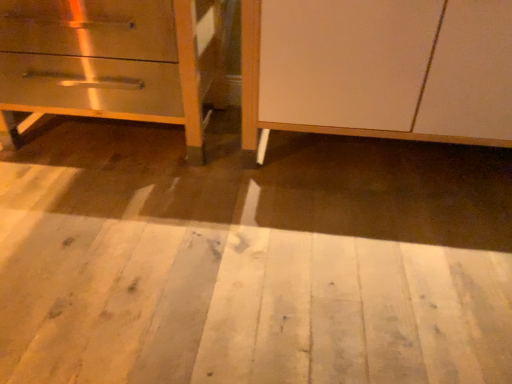
This screenshot has width=512, height=384. Find the location of `white wood floor at lower center`. white wood floor at lower center is located at coordinates (244, 283).

From the picture: What is the approximate width of white matte cabinet at center?

26.75 inches.

Identify the location of metallic silver drawer at left. (114, 62).

Which of these two, metallic silver drawer at left or white wood floor at lower center, is smaller?

Smaller between the two is white wood floor at lower center.

From a real-world perspective, who is located higher, metallic silver drawer at left or white wood floor at lower center?

metallic silver drawer at left.

Can we say metallic silver drawer at left lies outside white wood floor at lower center?

Absolutely, metallic silver drawer at left is external to white wood floor at lower center.

Relative to white wood floor at lower center, is metallic silver drawer at left in front or behind?

Clearly, metallic silver drawer at left is behind white wood floor at lower center.

Is white matte cabinet at center far away from white wood floor at lower center?

They are positioned close to each other.

Between point (364, 26) and point (122, 268), which one is positioned behind?

Positioned behind is point (364, 26).

Is white matte cabinet at center spatially inside white wood floor at lower center, or outside of it?

white matte cabinet at center cannot be found inside white wood floor at lower center.

Locate an element on the screen. furniture behind the white wood floor at lower center is located at coordinates (378, 69).

In the scene shown: From a real-world perspective, relative to white matte cabinet at center, is white wood floor at lower center vertically above or below?

From a real-world perspective, white wood floor at lower center is physically below white matte cabinet at center.

Is point (119, 348) closer or farther from the camera than point (274, 115)?

Point (119, 348).

Considering the sizes of objects white wood floor at lower center and white matte cabinet at center in the image provided, who is taller, white wood floor at lower center or white matte cabinet at center?

white matte cabinet at center.

From their relative heights in the image, would you say white matte cabinet at center is taller or shorter than metallic silver drawer at left?

Clearly, white matte cabinet at center is taller compared to metallic silver drawer at left.

From the picture: Is there a large distance between white matte cabinet at center and metallic silver drawer at left?

white matte cabinet at center is near metallic silver drawer at left, not far away.

Between white matte cabinet at center and metallic silver drawer at left, which one appears on the left side from the viewer's perspective?

Positioned to the left is metallic silver drawer at left.

Consider the image. Is white matte cabinet at center situated inside metallic silver drawer at left or outside?

white matte cabinet at center is spatially situated outside metallic silver drawer at left.

Can you tell me how much white wood floor at lower center and metallic silver drawer at left differ in facing direction?

They differ by 88.2 degrees in their facing directions.

Considering the positions of objects white wood floor at lower center and metallic silver drawer at left in the image provided, who is in front, white wood floor at lower center or metallic silver drawer at left?

white wood floor at lower center is in front.

From a real-world perspective, which is physically below, white wood floor at lower center or metallic silver drawer at left?

white wood floor at lower center, from a real-world perspective.

Which is more to the right, white wood floor at lower center or metallic silver drawer at left?

white wood floor at lower center is more to the right.

Could you tell me if metallic silver drawer at left is turned towards white matte cabinet at center?

No, metallic silver drawer at left is not turned towards white matte cabinet at center.

Is metallic silver drawer at left not inside white matte cabinet at center?

Yes, metallic silver drawer at left is not within white matte cabinet at center.

Is metallic silver drawer at left wider or thinner than white matte cabinet at center?

Clearly, metallic silver drawer at left has less width compared to white matte cabinet at center.

Where is `plywood that appears below the metallic silver drawer at left (from the image's perspective)`? plywood that appears below the metallic silver drawer at left (from the image's perspective) is located at coordinates (244, 283).

Identify the location of plywood on the left of white matte cabinet at center. This screenshot has width=512, height=384. (244, 283).

Which object lies nearer to the anchor point metallic silver drawer at left, white matte cabinet at center or white wood floor at lower center?

white matte cabinet at center lies closer to metallic silver drawer at left than the other object.

From the image, which object appears to be farther from white wood floor at lower center, metallic silver drawer at left or white matte cabinet at center?

metallic silver drawer at left.

Looking at the image, which one is located closer to metallic silver drawer at left, white wood floor at lower center or white matte cabinet at center?

Among the two, white matte cabinet at center is located nearer to metallic silver drawer at left.

Which object lies further to the anchor point white wood floor at lower center, white matte cabinet at center or metallic silver drawer at left?

Among the two, metallic silver drawer at left is located further to white wood floor at lower center.

Considering their positions, is metallic silver drawer at left positioned further to white matte cabinet at center than white wood floor at lower center?

metallic silver drawer at left is further to white matte cabinet at center.

Estimate the real-world distances between objects in this image. Which object is further from white matte cabinet at center, white wood floor at lower center or metallic silver drawer at left?

The object further to white matte cabinet at center is metallic silver drawer at left.

Find the location of a particular element. plywood located between metallic silver drawer at left and white matte cabinet at center in the left-right direction is located at coordinates (244, 283).